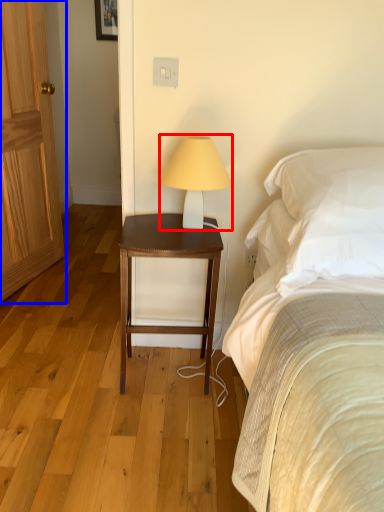
Question: Which of the following is the farthest to the observer, table lamp (highlighted by a red box) or door (highlighted by a blue box)?

Choices:
 (A) table lamp
 (B) door

Answer: (B)